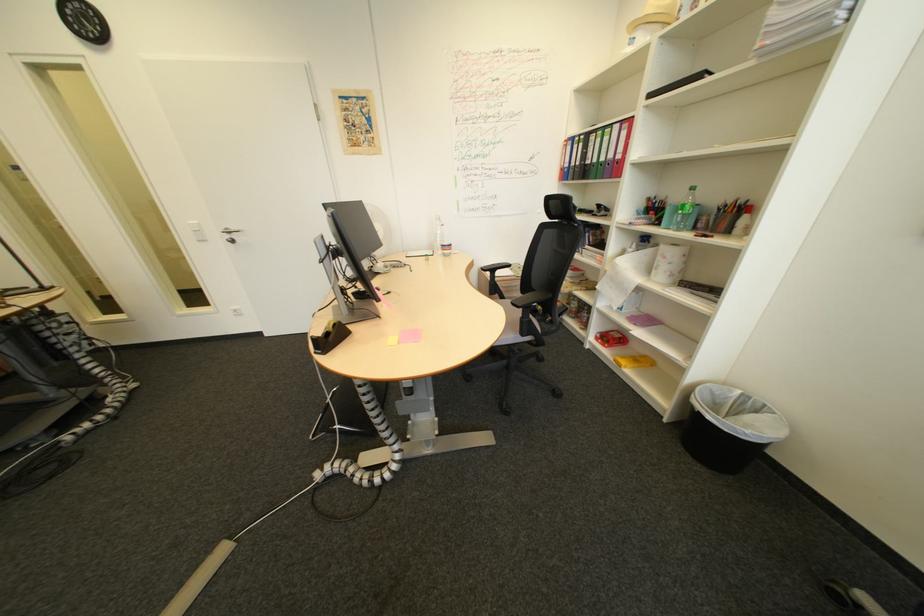
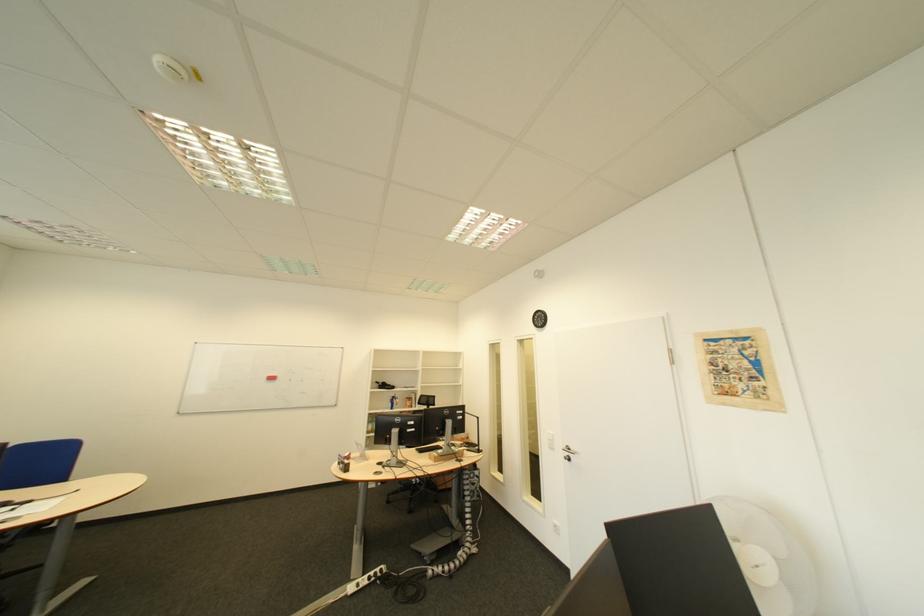
The point at [219,241] is marked in the first image. Where is the corresponding point in the second image?

(565, 451)